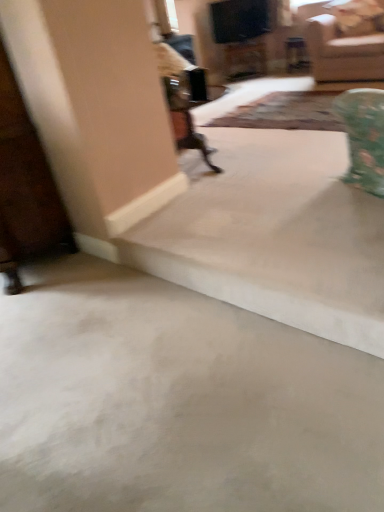
Question: Is point (215, 123) closer or farther from the camera than point (374, 76)?

Choices:
 (A) closer
 (B) farther

Answer: (A)

Question: Considering the relative positions of patterned fabric mat at center and beige fabric couch at upper right in the image provided, is patterned fabric mat at center to the left or to the right of beige fabric couch at upper right?

Choices:
 (A) left
 (B) right

Answer: (A)

Question: Which object is the closest to the beige fabric couch at upper right?

Choices:
 (A) beige smooth concrete at lower center
 (B) patterned fabric mat at center

Answer: (B)

Question: Based on their relative distances, which object is nearer to the patterned fabric mat at center?

Choices:
 (A) beige smooth concrete at lower center
 (B) beige fabric couch at upper right

Answer: (B)